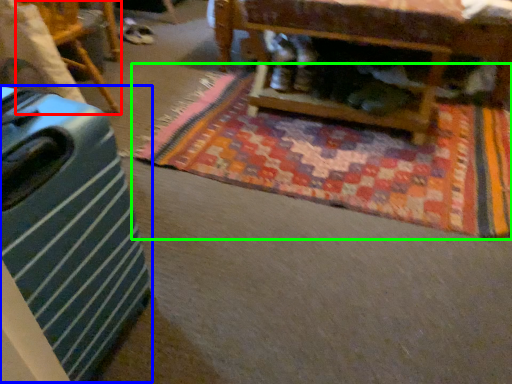
Question: Based on their relative distances, which object is nearer to furniture (highlighted by a red box)? Choose from luggage (highlighted by a blue box) and mat (highlighted by a green box).

Choices:
 (A) luggage
 (B) mat

Answer: (B)